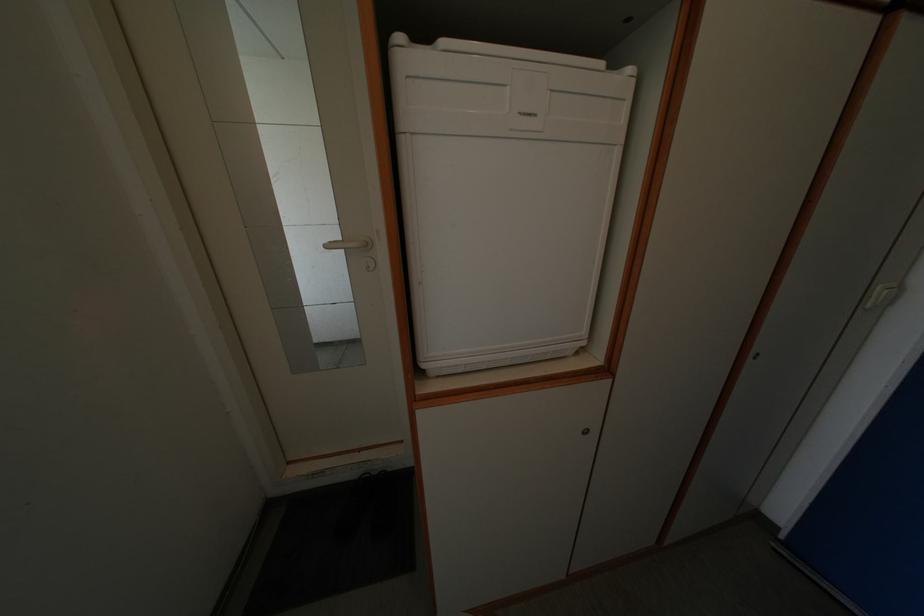
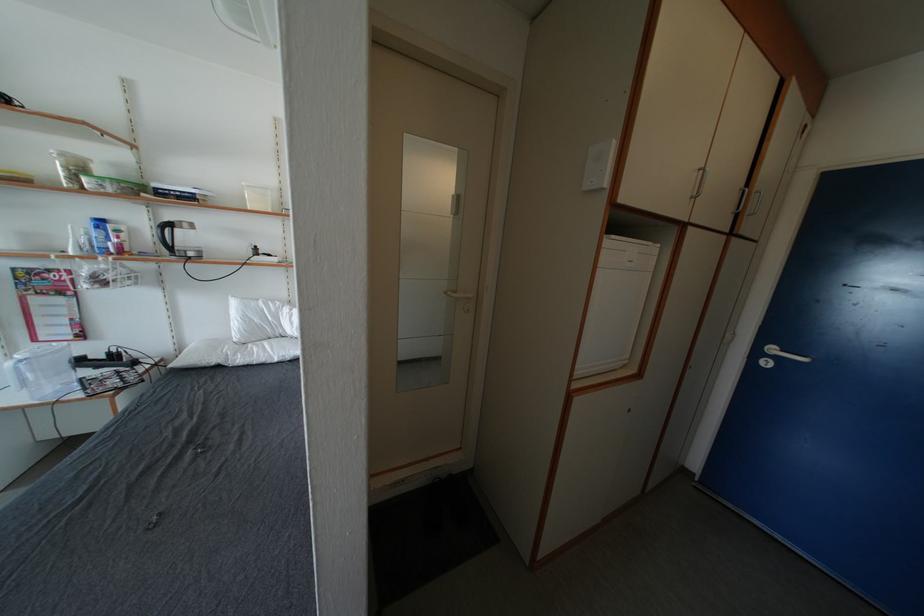
Question: The images are taken continuously from a first-person perspective. In which direction is your viewpoint rotating?

Choices:
 (A) Left
 (B) Right
 (C) Up
 (D) Down

Answer: (B)